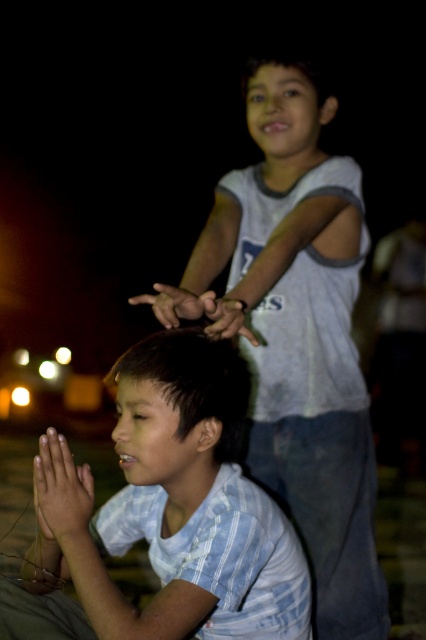
Question: Which point appears farthest from the camera in this image?

Choices:
 (A) (353, 189)
 (B) (241, 552)
 (C) (158, 380)

Answer: (A)

Question: Observing the image, what is the correct spatial positioning of dark brown hair at center in reference to matte skin hand at center?

Choices:
 (A) below
 (B) above

Answer: (A)

Question: Which object appears farthest from the camera in this image?

Choices:
 (A) light blue striped shirt at lower left
 (B) dark brown hair at center

Answer: (B)

Question: Which is nearer to the matte skin hand at center?

Choices:
 (A) smooth skin hand at center
 (B) dark brown hair at center
 (C) smooth skin hands at center

Answer: (A)

Question: Observing the image, what is the correct spatial positioning of white cotton shirt at upper center in reference to dark brown hair at center?

Choices:
 (A) right
 (B) left

Answer: (A)

Question: Can you confirm if light blue striped shirt at lower left is bigger than smooth skin hand at center?

Choices:
 (A) yes
 (B) no

Answer: (A)